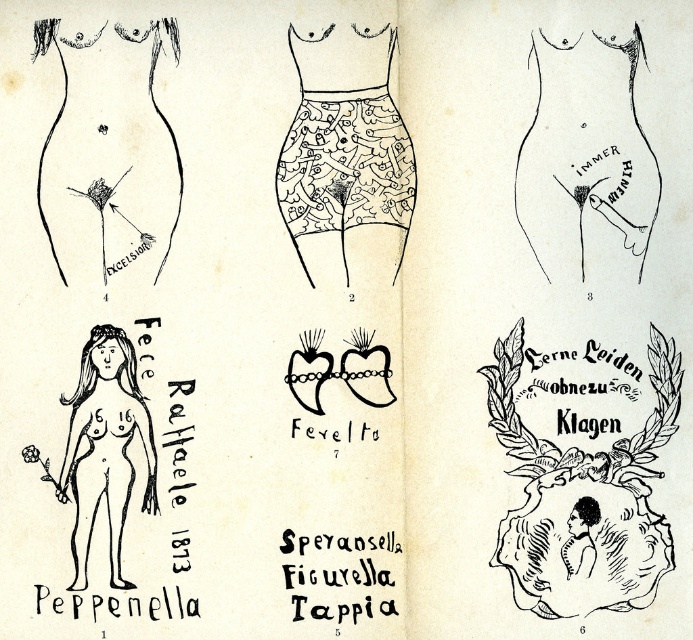
Is point (168, 177) less distant than point (581, 205)?

No, (168, 177) is further to viewer.

Consider the image. Is matte black underwear at lower left positioned in front of black ink drawing of torso at upper center?

No, matte black underwear at lower left is behind black ink drawing of torso at upper center.

Is point (157, 227) positioned behind point (656, 202)?

Yes, point (157, 227) is behind point (656, 202).

Locate an element on the screen. matte black underwear at lower left is located at coordinates (109, 156).

Which is below, black paper laurel wreath at center or black line drawing nude woman at lower left?

black paper laurel wreath at center is below.

Is black paper laurel wreath at center wider than black line drawing nude woman at lower left?

Yes.

Describe the element at coordinates (584, 500) in the screenshot. The image size is (693, 640). I see `black paper laurel wreath at center` at that location.

The width and height of the screenshot is (693, 640). I want to click on black paper laurel wreath at center, so click(584, 500).

Can you confirm if black lace underwear at center is thinner than black lace bikini top at upper center?

No.

Looking at this image, is black lace underwear at center wider than black lace bikini top at upper center?

Indeed, black lace underwear at center has a greater width compared to black lace bikini top at upper center.

The width and height of the screenshot is (693, 640). Find the location of `black lace underwear at center`. black lace underwear at center is located at coordinates (344, 166).